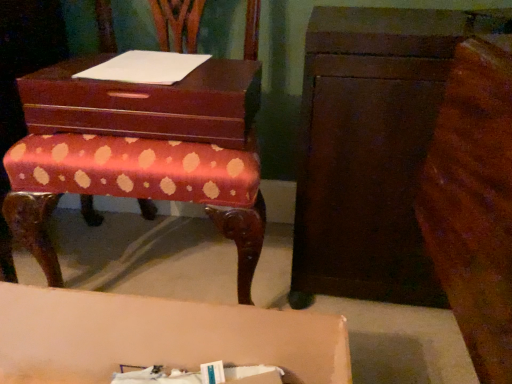
Question: From the image's perspective, is polished wood bench at center positioned above or below matte pink table at lower center?

Choices:
 (A) below
 (B) above

Answer: (B)

Question: Considering the positions of point (96, 102) and point (314, 375), is point (96, 102) closer or farther from the camera than point (314, 375)?

Choices:
 (A) closer
 (B) farther

Answer: (B)

Question: Which object is the farthest from the mahogany wood storage box at center?

Choices:
 (A) polished wood bench at center
 (B) white paper at upper center
 (C) matte pink table at lower center
 (D) dark brown wood chest of drawers at right

Answer: (C)

Question: Which is nearer to the polished wood bench at center?

Choices:
 (A) matte pink table at lower center
 (B) white paper at upper center
 (C) mahogany wood storage box at center
 (D) dark brown wood chest of drawers at right

Answer: (C)